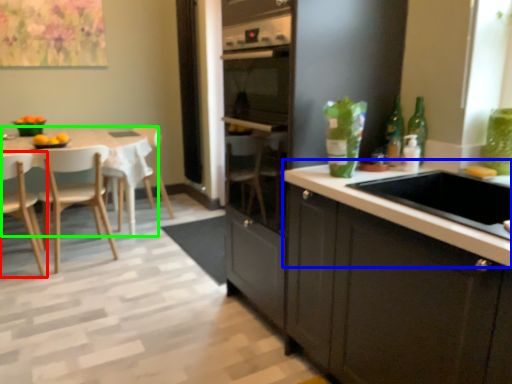
Question: Based on their relative distances, which object is farther from chair (highlighted by a red box)? Choose from countertop (highlighted by a blue box) and kitchen & dining room table (highlighted by a green box).

Choices:
 (A) countertop
 (B) kitchen & dining room table

Answer: (A)